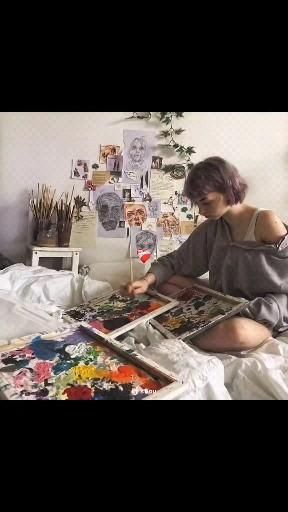
Where is `space above endtable`? The image size is (288, 512). space above endtable is located at coordinates (55, 156).